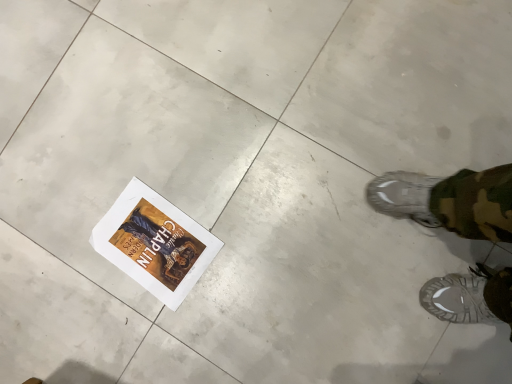
Identify the location of white paper postcard at lower left. This screenshot has width=512, height=384. (154, 243).

What do you see at coordinates (154, 243) in the screenshot? The height and width of the screenshot is (384, 512). I see `white paper postcard at lower left` at bounding box center [154, 243].

The height and width of the screenshot is (384, 512). I want to click on white paper postcard at lower left, so click(154, 243).